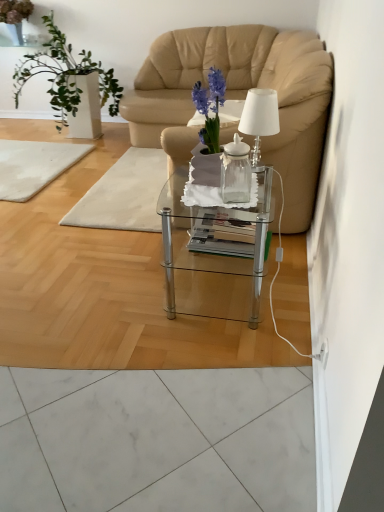
What is the approximate height of white glossy vase at left?

The height of white glossy vase at left is 3.52 feet.

Measure the distance between point (5, 142) and camera.

The depth of point (5, 142) is 3.94 meters.

What do you see at coordinates (34, 165) in the screenshot? I see `white marble mat at left, the 1th mat positioned from the left` at bounding box center [34, 165].

This screenshot has height=512, width=384. Describe the element at coordinates (235, 172) in the screenshot. I see `transparent glass vase at center` at that location.

What do you see at coordinates (259, 118) in the screenshot? This screenshot has width=384, height=512. I see `white glass table lamp at upper right` at bounding box center [259, 118].

Where is `clear glass coffee table at center`? The width and height of the screenshot is (384, 512). clear glass coffee table at center is located at coordinates (215, 253).

What's the angular difference between translucent glass table at center, acting as the 2th mat starting from the left, and white glossy vase at left's facing directions?

The angle between the facing direction of translucent glass table at center, acting as the 2th mat starting from the left, and the facing direction of white glossy vase at left is 89.8 degrees.

Looking at this image, between translucent glass table at center, acting as the 2th mat starting from the left, and white glossy vase at left, which one has more height?

white glossy vase at left is taller.

From a real-world perspective, which object rests below the other?

translucent glass table at center, acting as the 2th mat starting from the left, from a real-world perspective.

Which of these two, white glass table lamp at upper right or transparent glass vase at center, is bigger?

white glass table lamp at upper right.

Would you say white glass table lamp at upper right is to the left or to the right of transparent glass vase at center in the picture?

From the image, it's evident that white glass table lamp at upper right is to the right of transparent glass vase at center.

Which of these two, white glass table lamp at upper right or transparent glass vase at center, stands shorter?

transparent glass vase at center.

Based on the photo, between beige leather armchair at center and white glossy vase at left, which one has larger size?

With larger size is beige leather armchair at center.

Is beige leather armchair at center not inside white glossy vase at left?

Yes, beige leather armchair at center is not within white glossy vase at left.

Measure the distance from beige leather armchair at center to white glossy vase at left.

28.11 inches.

Can you confirm if beige leather armchair at center is thinner than white glossy vase at left?

Incorrect, the width of beige leather armchair at center is not less than that of white glossy vase at left.

Is white glass table lamp at upper right outside of beige leather armchair at center?

Yes, white glass table lamp at upper right is not within beige leather armchair at center.

From a real-world perspective, who is located lower, white glass table lamp at upper right or beige leather armchair at center?

beige leather armchair at center, from a real-world perspective.

Are white glass table lamp at upper right and beige leather armchair at center located far from each other?

white glass table lamp at upper right is far away from beige leather armchair at center.

At what (x,y) coordinates should I click in order to perform the action: click on table lamp on the right of beige leather armchair at center. Please return your answer as a coordinate pair (x, y). Looking at the image, I should click on (259, 118).

Is translucent glass table at center, acting as the 2th mat starting from the left, inside the boundaries of beige leather armchair at center, or outside?

translucent glass table at center, acting as the 2th mat starting from the left, is inside beige leather armchair at center.

Considering their positions, is translucent glass table at center, acting as the 2th mat starting from the left, located in front of or behind beige leather armchair at center?

translucent glass table at center, acting as the 2th mat starting from the left, is positioned farther from the viewer than beige leather armchair at center.

How many degrees apart are the facing directions of translucent glass table at center, the 1th mat in the right-to-left sequence, and beige leather armchair at center?

The angular difference between translucent glass table at center, the 1th mat in the right-to-left sequence, and beige leather armchair at center is 0.483 degrees.

Is translucent glass table at center, acting as the 2th mat starting from the left, to the right of beige leather armchair at center from the viewer's perspective?

In fact, translucent glass table at center, acting as the 2th mat starting from the left, is to the left of beige leather armchair at center.

Locate an element on the screen. mat on the left of white glossy vase at left is located at coordinates (34, 165).

Looking at this image, could you measure the distance between white glossy vase at left and white marble mat at left, which is the second mat in right-to-left order?

25.61 inches.

Considering the sizes of objects white glossy vase at left and white marble mat at left, which is the second mat in right-to-left order, in the image provided, who is shorter, white glossy vase at left or white marble mat at left, which is the second mat in right-to-left order,?

With less height is white marble mat at left, which is the second mat in right-to-left order.

From a real-world perspective, is white glossy vase at left positioned under white marble mat at left, which is the second mat in right-to-left order, based on gravity?

No.

Is transparent glass vase at center positioned with its back to beige leather armchair at center?

No, transparent glass vase at center is not facing the opposite direction of beige leather armchair at center.

Are transparent glass vase at center and beige leather armchair at center located far from each other?

Yes, transparent glass vase at center and beige leather armchair at center are located far from each other.

Can you confirm if transparent glass vase at center is smaller than beige leather armchair at center?

Yes, transparent glass vase at center is smaller than beige leather armchair at center.

Consider the image. Looking at their sizes, would you say transparent glass vase at center is wider or thinner than beige leather armchair at center?

Clearly, transparent glass vase at center has less width compared to beige leather armchair at center.

Where is `mat that is the 1st object directly below the white glossy vase at left (from a real-world perspective)`? This screenshot has width=384, height=512. mat that is the 1st object directly below the white glossy vase at left (from a real-world perspective) is located at coordinates (124, 194).

You are a GUI agent. You are given a task and a screenshot of the screen. Output one action in this format:
    pyautogui.click(x=<x>, y=<y>)
    Task: Click on the table lamp on the right of transparent glass vase at center
    This screenshot has height=512, width=384.
    Given the screenshot: What is the action you would take?
    point(259,118)

From the image, which object appears to be nearer to white glossy vase at left, clear glass coffee table at center or translucent glass table at center, the 1th mat in the right-to-left sequence?

translucent glass table at center, the 1th mat in the right-to-left sequence.

Which object lies nearer to the anchor point white glossy vase at left, transparent glass vase at center or white glass table lamp at upper right?

white glass table lamp at upper right is positioned closer to the anchor white glossy vase at left.

Based on their spatial positions, is translucent glass table at center, acting as the 2th mat starting from the left, or transparent glass vase at center closer to white marble mat at left, the 1th mat positioned from the left?

translucent glass table at center, acting as the 2th mat starting from the left.

Which object lies nearer to the anchor point clear glass coffee table at center, beige leather armchair at center or white marble mat at left, which is the second mat in right-to-left order?

white marble mat at left, which is the second mat in right-to-left order, is positioned closer to the anchor clear glass coffee table at center.

Based on their spatial positions, is transparent glass vase at center or clear glass coffee table at center further from white marble mat at left, which is the second mat in right-to-left order?

Based on the image, transparent glass vase at center appears to be further to white marble mat at left, which is the second mat in right-to-left order.

Which object lies nearer to the anchor point translucent glass table at center, acting as the 2th mat starting from the left, white marble mat at left, the 1th mat positioned from the left, or transparent glass vase at center?

white marble mat at left, the 1th mat positioned from the left, lies closer to translucent glass table at center, acting as the 2th mat starting from the left, than the other object.

Considering their positions, is transparent glass vase at center positioned closer to white glossy vase at left than beige leather armchair at center?

Among the two, beige leather armchair at center is located nearer to white glossy vase at left.

From the image, which object appears to be farther from transparent glass vase at center, translucent glass table at center, acting as the 2th mat starting from the left, or white glossy vase at left?

Among the two, white glossy vase at left is located further to transparent glass vase at center.

Where is `mat between white marble mat at left, which is the second mat in right-to-left order, and transparent glass vase at center from left to right`? This screenshot has width=384, height=512. mat between white marble mat at left, which is the second mat in right-to-left order, and transparent glass vase at center from left to right is located at coordinates (124, 194).

Where is `chair between white marble mat at left, the 1th mat positioned from the left, and clear glass coffee table at center`? The height and width of the screenshot is (512, 384). chair between white marble mat at left, the 1th mat positioned from the left, and clear glass coffee table at center is located at coordinates (240, 98).

The height and width of the screenshot is (512, 384). I want to click on vase situated between white marble mat at left, the 1th mat positioned from the left, and clear glass coffee table at center from left to right, so click(x=235, y=172).

This screenshot has height=512, width=384. Identify the location of vase between clear glass coffee table at center and white glossy vase at left along the z-axis. (235, 172).